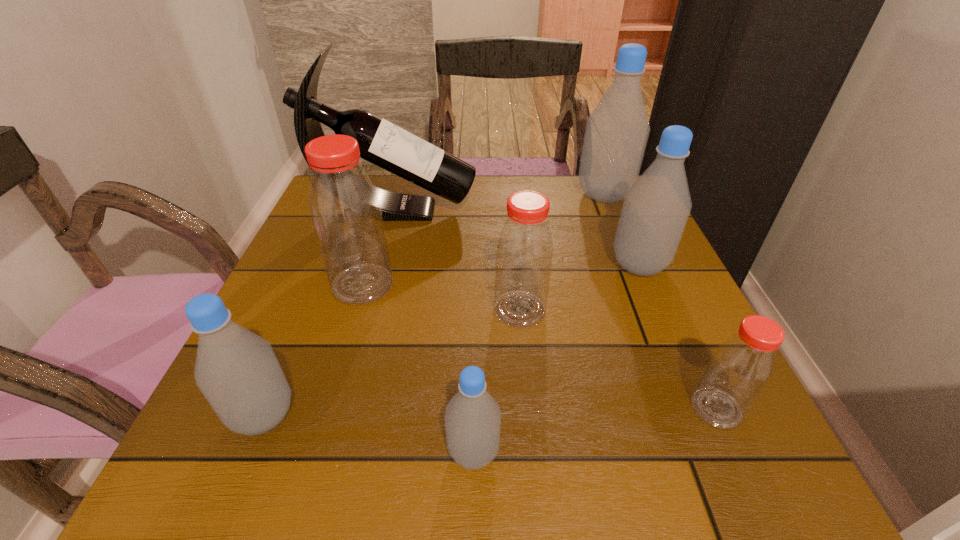
Where is `free region located on the stand of the wine bottle`? free region located on the stand of the wine bottle is located at coordinates (577, 210).

I want to click on free space located on the left of the farthest gray bottle, so click(x=445, y=195).

The width and height of the screenshot is (960, 540). In order to click on vacant position located on the right of the leftmost red bottle in this screenshot , I will do `click(492, 285)`.

Locate an element on the screen. vacant space situated 0.290m on the left of the second biggest gray bottle is located at coordinates (473, 266).

Image resolution: width=960 pixels, height=540 pixels. Find the location of `blank space located 0.060m on the right of the second smallest red bottle`. blank space located 0.060m on the right of the second smallest red bottle is located at coordinates (578, 309).

Find the location of a particular element. free spot located on the back of the leftmost gray bottle is located at coordinates (324, 268).

I want to click on vacant space situated on the left of the nearest red bottle, so 516,408.

Locate an element on the screen. This screenshot has width=960, height=540. vacant space located 0.290m on the back of the third gray bottle from right to left is located at coordinates (475, 294).

The image size is (960, 540). What are the coordinates of `wine bottle that is at the far edge` in the screenshot? It's located at (382, 143).

At what (x,y) coordinates should I click in order to perform the action: click on bottle that is at the far edge. Please return your answer as a coordinate pair (x, y). The image size is (960, 540). Looking at the image, I should click on tap(617, 130).